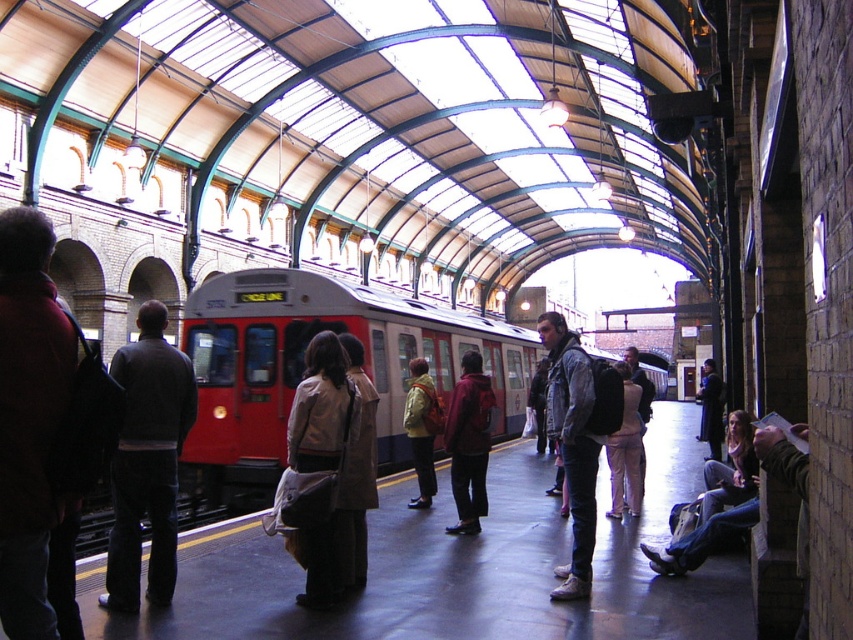
Question: Based on their relative distances, which object is farther from the yellow fabric jacket at center?

Choices:
 (A) red jacket at left
 (B) dark gray sweater at left
 (C) red matte train at center
 (D) denim jacket at center

Answer: (A)

Question: From the image, what is the correct spatial relationship of red matte train at center in relation to dark gray sweater at left?

Choices:
 (A) below
 (B) above

Answer: (B)

Question: Based on their relative distances, which object is farther from the red matte train at center?

Choices:
 (A) dark gray sweater at left
 (B) denim jacket at center

Answer: (A)

Question: Considering the relative positions of red matte train at center and red jacket at left in the image provided, where is red matte train at center located with respect to red jacket at left?

Choices:
 (A) left
 (B) right

Answer: (B)

Question: Is red matte train at center smaller than denim jacket at center?

Choices:
 (A) no
 (B) yes

Answer: (A)

Question: Which object is positioned closest to the red jacket at left?

Choices:
 (A) yellow fabric jacket at center
 (B) denim jacket at center
 (C) dark gray sweater at left
 (D) red matte train at center

Answer: (C)